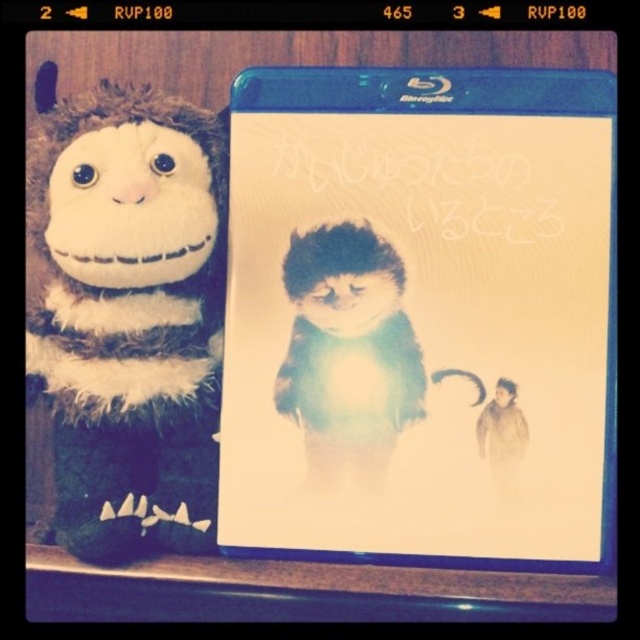
Question: Which of the following is the farthest from the observer?

Choices:
 (A) fuzzy brown plush monkey at left
 (B) blue plastic dvd case at center

Answer: (B)

Question: Is blue plastic dvd case at center closer to camera compared to fuzzy brown plush monkey at left?

Choices:
 (A) yes
 (B) no

Answer: (B)

Question: Which point is farther to the camera?

Choices:
 (A) fuzzy brown plush monkey at left
 (B) blue plastic dvd case at center

Answer: (B)

Question: Among these objects, which one is nearest to the camera?

Choices:
 (A) fuzzy brown plush monkey at left
 (B) blue plastic dvd case at center

Answer: (A)

Question: Does blue plastic dvd case at center have a greater width compared to fuzzy brown plush monkey at left?

Choices:
 (A) yes
 (B) no

Answer: (A)

Question: Can you confirm if blue plastic dvd case at center is positioned to the left of fuzzy brown plush monkey at left?

Choices:
 (A) yes
 (B) no

Answer: (B)